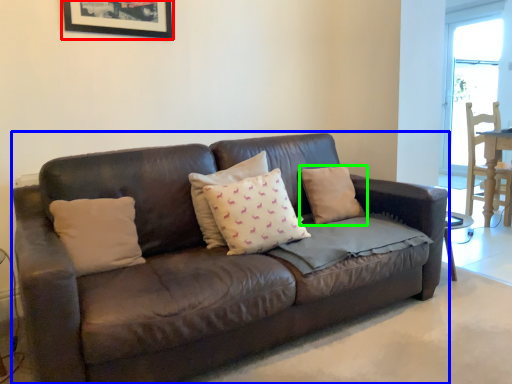
Question: Considering the real-world distances, which object is farthest from picture frame (highlighted by a red box)? studio couch (highlighted by a blue box) or pillow (highlighted by a green box)?

Choices:
 (A) studio couch
 (B) pillow

Answer: (B)